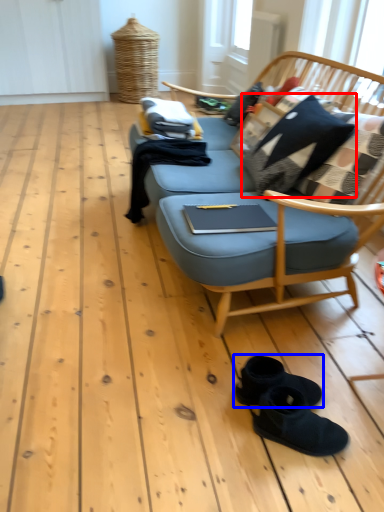
Question: Among these objects, which one is nearest to the camera, pillow (highlighted by a red box) or footwear (highlighted by a blue box)?

Choices:
 (A) pillow
 (B) footwear

Answer: (B)